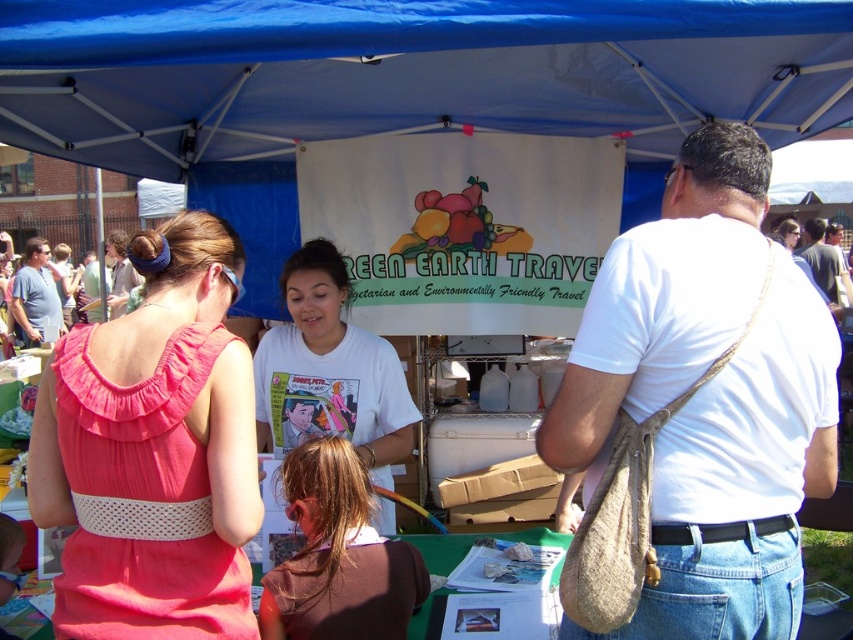
Question: Which point appears closest to the camera in this image?

Choices:
 (A) (822, 280)
 (B) (18, 296)
 (C) (115, 269)

Answer: (A)

Question: Is pink fabric dress at upper left behind brown hair at center?

Choices:
 (A) no
 (B) yes

Answer: (A)

Question: Which point is farther to the camera?

Choices:
 (A) (299, 420)
 (B) (22, 292)
 (C) (805, 248)
 (D) (53, 392)

Answer: (C)

Question: Considering the real-world distances, which object is farthest from the white cotton shirt at center?

Choices:
 (A) white cotton t-shirt at center
 (B) white cotton shirt at upper right

Answer: (B)

Question: Is matte blue shirt at left smaller than matte pink dress at center?

Choices:
 (A) yes
 (B) no

Answer: (B)

Question: From the image, what is the correct spatial relationship of matte blue shirt at left in relation to matte pink dress at center?

Choices:
 (A) left
 (B) right

Answer: (A)